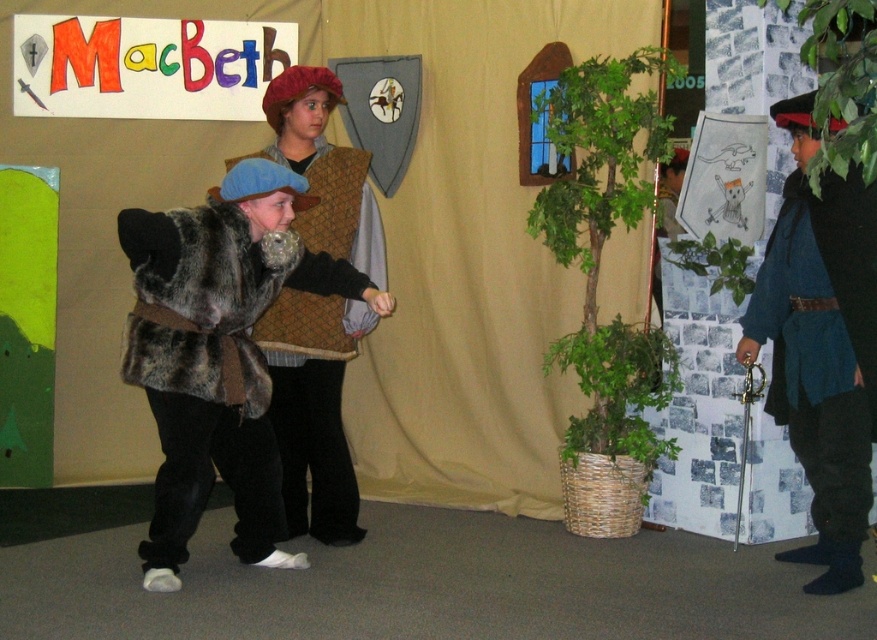
You are a stagehand observing the performance from the back of the stage. You notice two points marked on the stage floor for prop placement. The first point is at coordinates point (297, 307) and the second is at point (170, 339). Which point is closer to you?

Point (297, 307) is behind point (170, 339), so the point closer to you is point (170, 339).

You are an actor in the school play and need to retrieve your fur vest from the stage. The stage manager tells you that the fur vest is located at point (312,406). Can you describe where exactly on the stage you should look for it?

The fur vest is located at point (312,406), which is at the center of the stage.